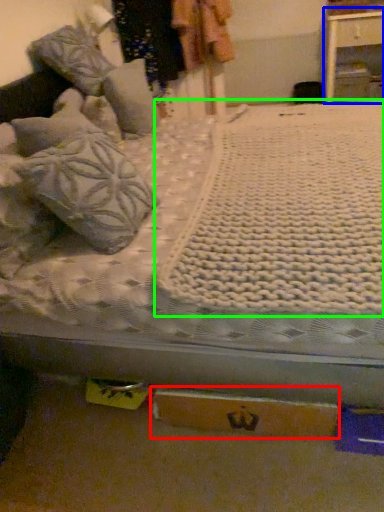
Question: Estimate the real-world distances between objects in this image. Which object is farther from cardboard box (highlighted by a red box), nightstand (highlighted by a blue box) or blanket (highlighted by a green box)?

Choices:
 (A) nightstand
 (B) blanket

Answer: (A)